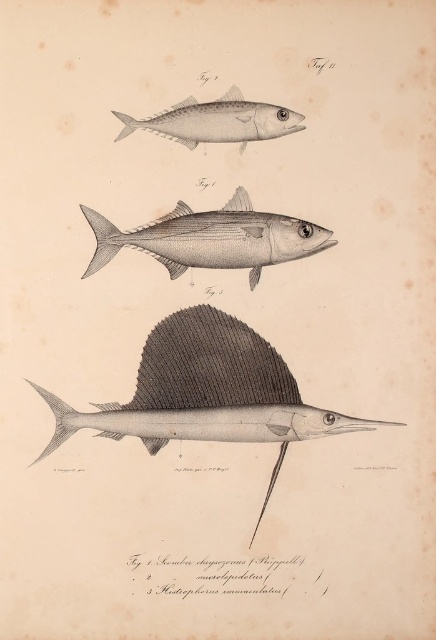
Question: Which point appears closest to the camera in this image?

Choices:
 (A) pyautogui.click(x=186, y=410)
 (B) pyautogui.click(x=204, y=125)

Answer: (B)

Question: Which point is farther to the camera?

Choices:
 (A) grayish silver fish at center
 (B) gray matte fish at upper center
 (C) gray matte sailfish at center

Answer: (A)

Question: Among these points, which one is nearest to the camera?

Choices:
 (A) (91, 259)
 (B) (71, 417)

Answer: (B)

Question: Does grayish silver fish at center appear over gray matte fish at upper center?

Choices:
 (A) no
 (B) yes

Answer: (A)

Question: Can you confirm if gray matte sailfish at center is positioned to the left of gray matte fish at upper center?

Choices:
 (A) no
 (B) yes

Answer: (A)

Question: In this image, where is grayish silver fish at center located relative to gray matte fish at upper center?

Choices:
 (A) right
 (B) left

Answer: (B)